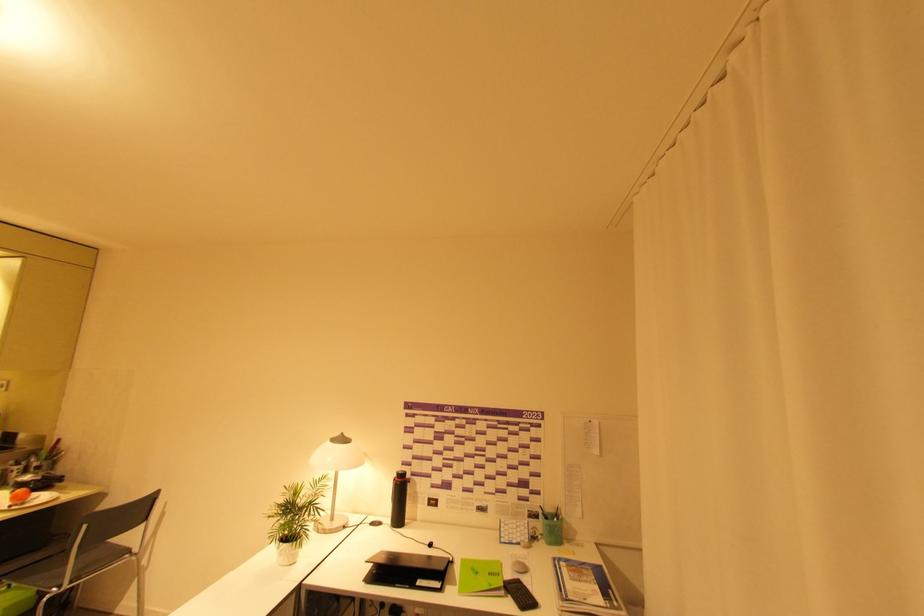
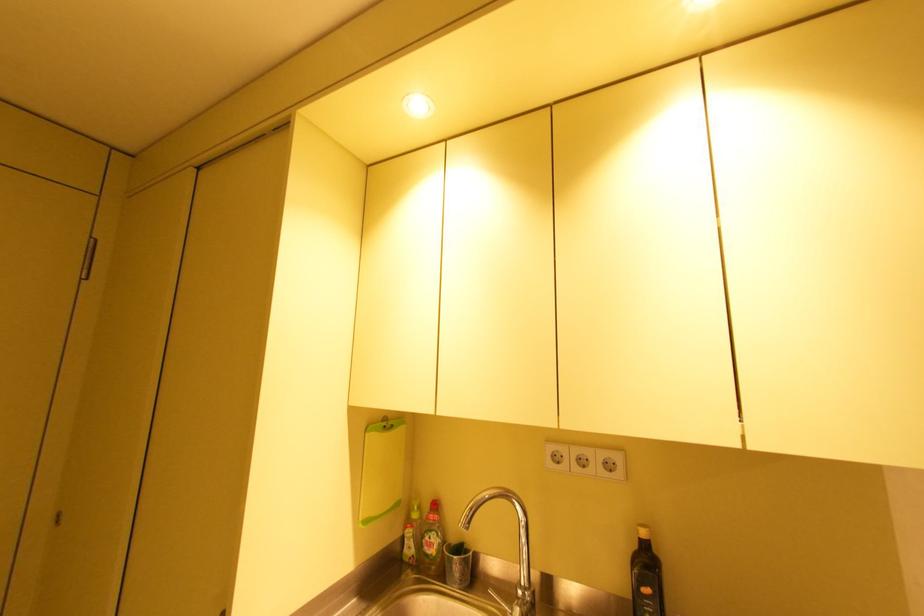
Which direction would the cameraman need to move to produce the second image?

The cameraman moved toward left, forward.